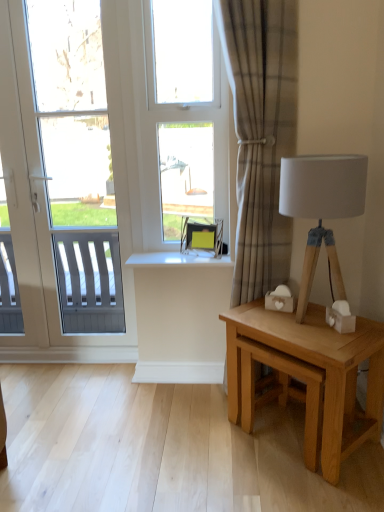
Locate an element on the screen. The width and height of the screenshot is (384, 512). free spot above white glossy window sill at center (from a real-world perspective) is located at coordinates (186, 251).